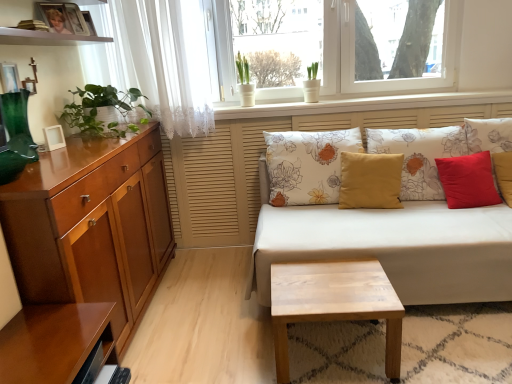
The image size is (512, 384). Find the location of `vacant space to the right of green glass vase at left`. vacant space to the right of green glass vase at left is located at coordinates (70, 157).